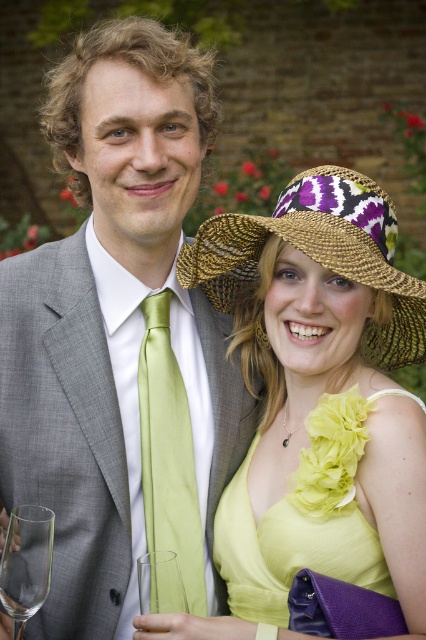
Can you confirm if matte yellow dress at center is smaller than yellow chiffon dress at center?

No.

Does matte yellow dress at center appear on the right side of yellow chiffon dress at center?

Indeed, matte yellow dress at center is positioned on the right side of yellow chiffon dress at center.

Who is more distant from viewer, (331, 346) or (252, 548)?

The point (331, 346) is more distant.

Where is `matte yellow dress at center`? This screenshot has height=640, width=426. matte yellow dress at center is located at coordinates (308, 307).

How far apart are matte gray suit at center and yellow chiffon dress at center?

The distance of matte gray suit at center from yellow chiffon dress at center is 13.15 inches.

Locate an element on the screen. This screenshot has width=426, height=640. matte gray suit at center is located at coordinates click(120, 339).

Can you confirm if yellow chiffon dress at center is bigger than braided straw hat at upper right?

No, yellow chiffon dress at center is not bigger than braided straw hat at upper right.

What do you see at coordinates (304, 518) in the screenshot? Image resolution: width=426 pixels, height=640 pixels. I see `yellow chiffon dress at center` at bounding box center [304, 518].

Locate an element on the screen. yellow chiffon dress at center is located at coordinates (304, 518).